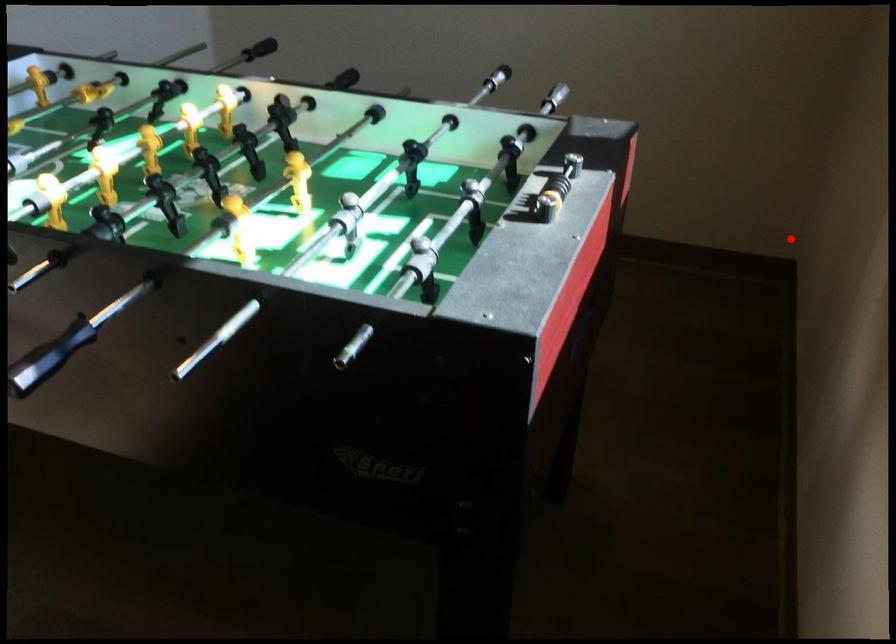
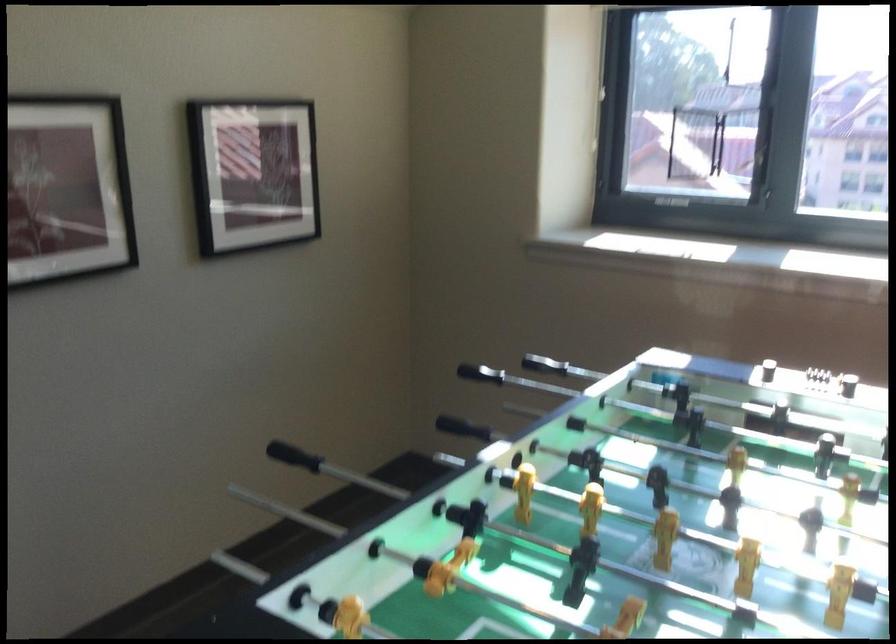
In the second image, find the point that corresponds to the highlighted location in the first image.

(463, 428)